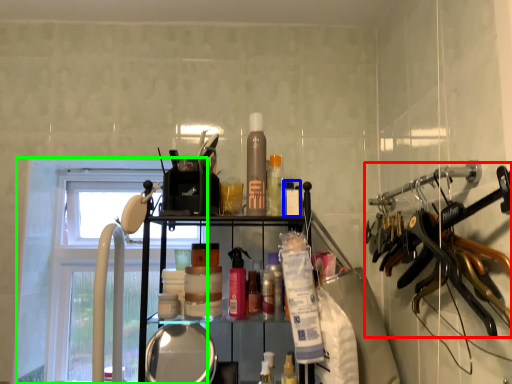
Question: Based on their relative distances, which object is nearer to hanger (highlighted by a red box)? Choose from toiletry (highlighted by a blue box) and window (highlighted by a green box).

Choices:
 (A) toiletry
 (B) window

Answer: (A)